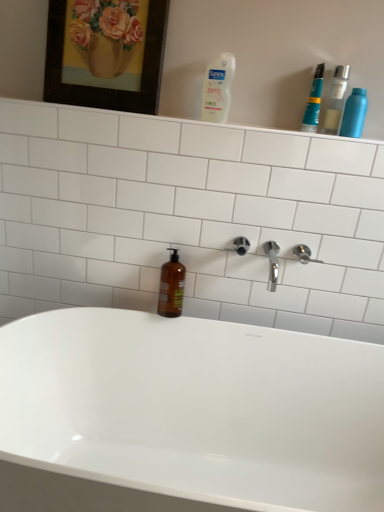
Where is `free location to the left of metallic blue spray can at upper right, acting as the 2th cleaning product starting from the left`? This screenshot has width=384, height=512. free location to the left of metallic blue spray can at upper right, acting as the 2th cleaning product starting from the left is located at coordinates (311, 132).